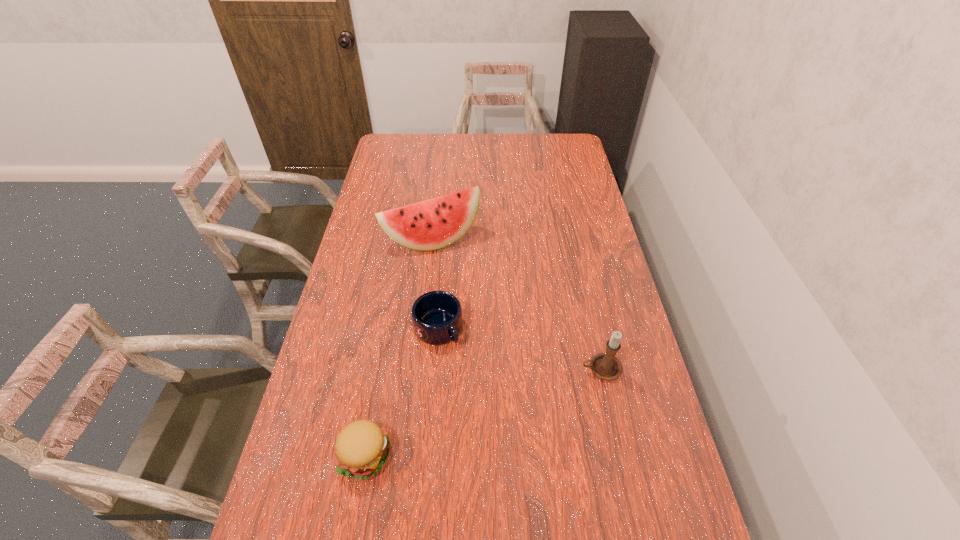
The height and width of the screenshot is (540, 960). Identify the location of vacant space on the desktop that is between the nearest object and the rightmost object and is positioned on the outer rind of the watermelon. (520, 399).

At what (x,y) coordinates should I click in order to perform the action: click on vacant space on the desktop that is between the nearest object and the second tallest object and is positioned with the handle on the side of the third nearest object. Please return your answer as a coordinate pair (x, y). This screenshot has height=540, width=960. Looking at the image, I should click on (504, 404).